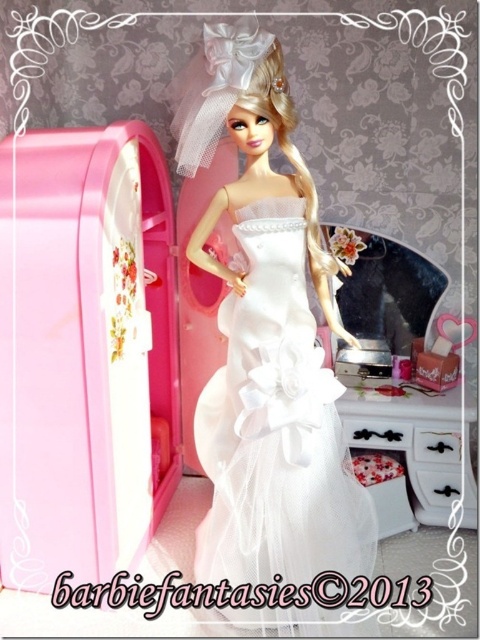
Consider the image. Does matte white dress at center appear on the right side of white wood dresser at lower right?

In fact, matte white dress at center is to the left of white wood dresser at lower right.

Who is lower down, matte white dress at center or white wood dresser at lower right?

white wood dresser at lower right is lower down.

Measure the distance between matte white dress at center and camera.

matte white dress at center is 1.00 meters away from camera.

Find the location of a particular element. Image resolution: width=480 pixels, height=640 pixels. matte white dress at center is located at coordinates (266, 337).